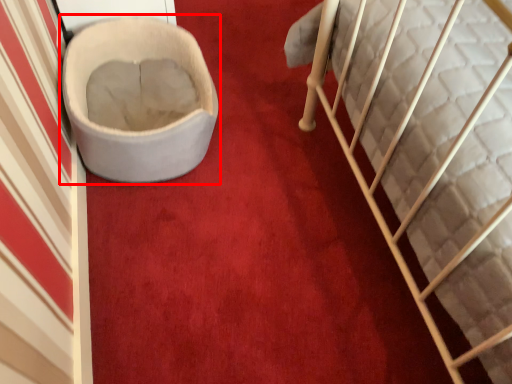
Question: From the image's perspective, where is toilet (annotated by the red box) located relative to furniture?

Choices:
 (A) below
 (B) above

Answer: (B)